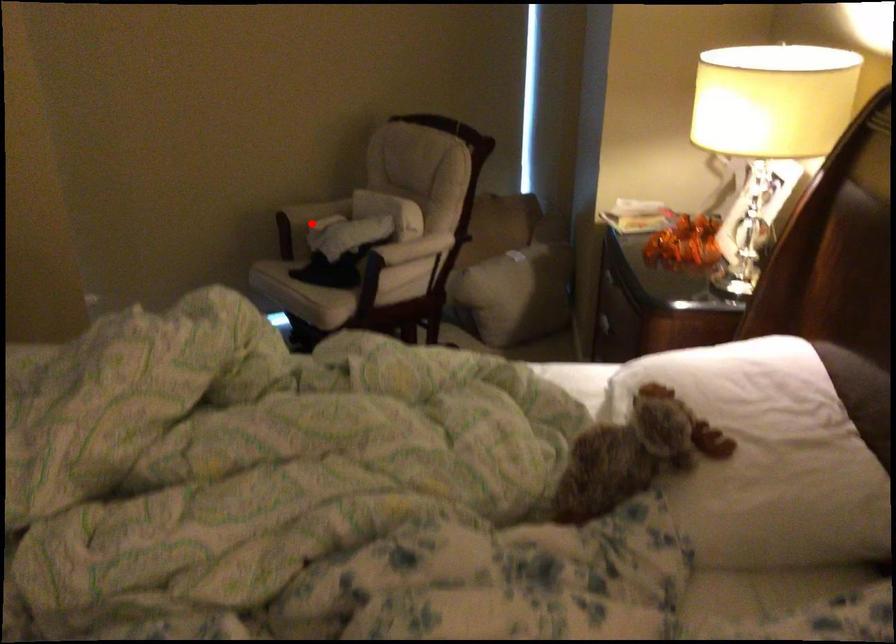
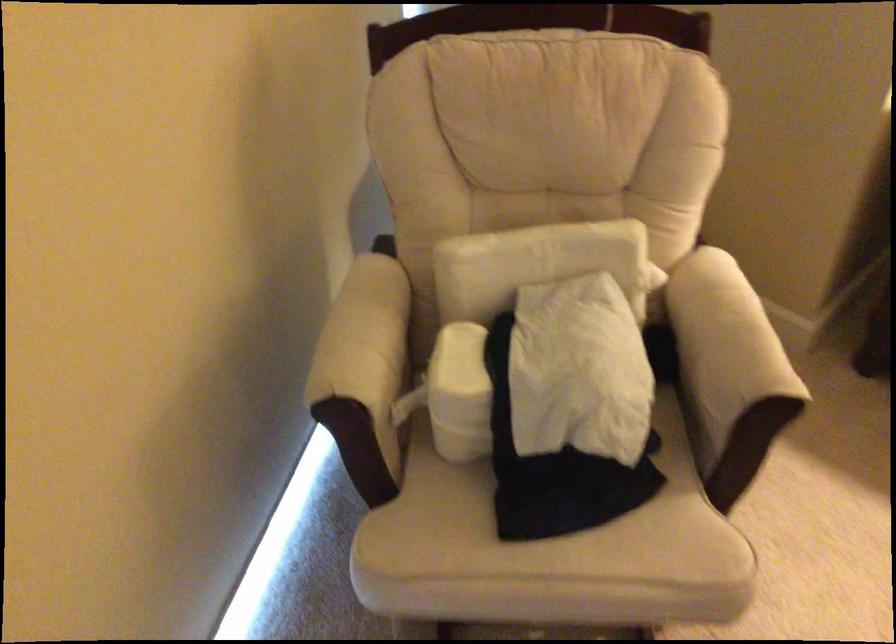
The point at the highlighted location is marked in the first image. Where is the corresponding point in the second image?

(460, 393)